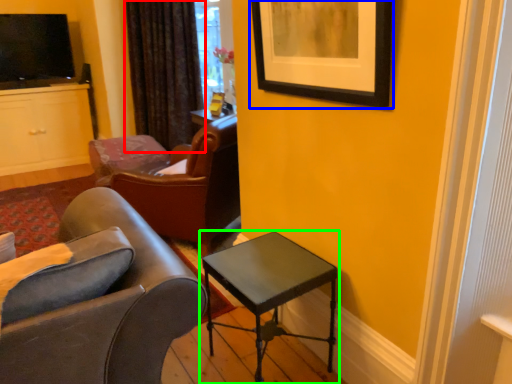
Question: Based on their relative distances, which object is nearer to curtain (highlighted by a red box)? Choose from picture frame (highlighted by a blue box) and table (highlighted by a green box).

Choices:
 (A) picture frame
 (B) table

Answer: (A)